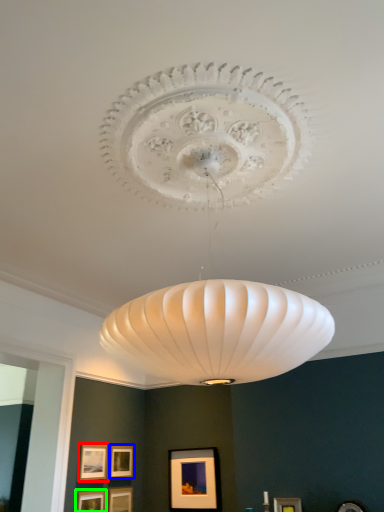
Question: Which object is the farthest from picture frame (highlighted by a red box)? Choose among these: picture frame (highlighted by a blue box) or picture frame (highlighted by a green box).

Choices:
 (A) picture frame
 (B) picture frame

Answer: (B)